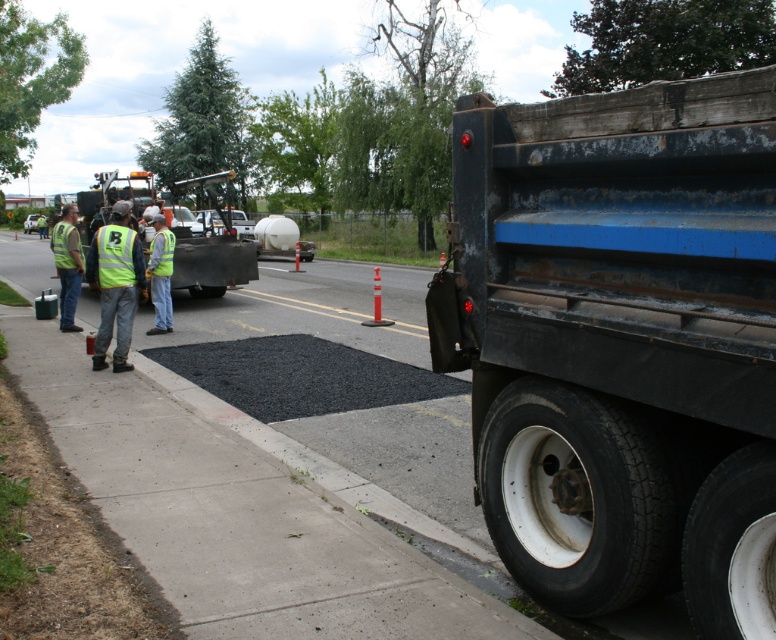
You are a pedestrian standing at the point marked by the coordinates (x=160, y=275). You want to cross the road to the other side. Is there a safe path available that avoids the dump truck and the asphalt area?

The yellow reflective vest at center is located at point (x=160, y=275), so the dump truck is on the right side of the frame. The asphalt is spread near the rear of the dump truck, so the safe path would be to walk around the left side of the dump truck and avoid the asphalt area.